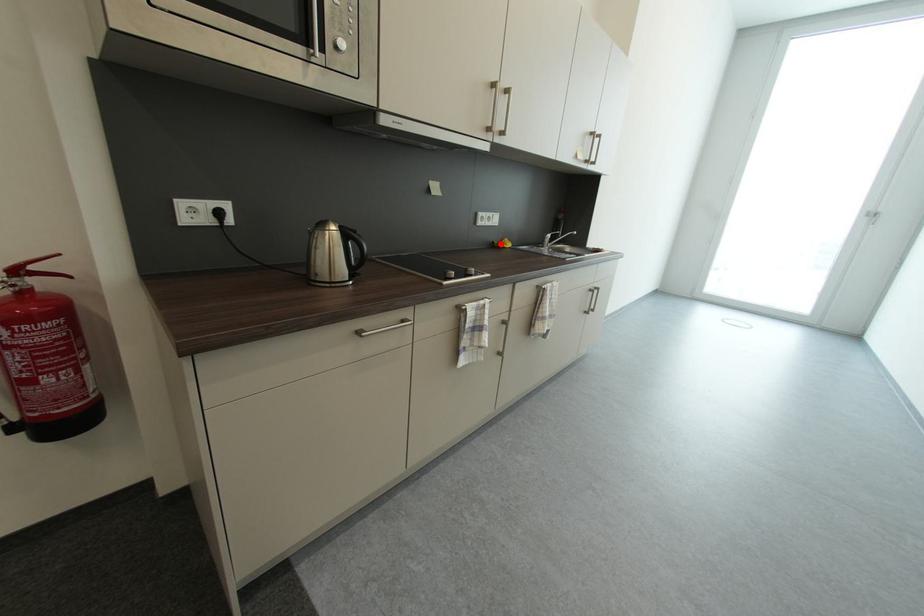
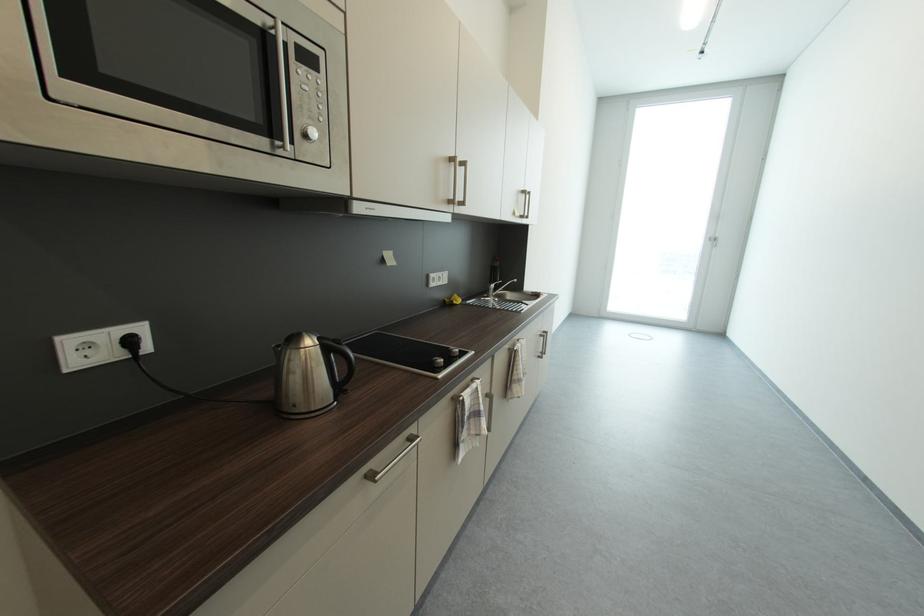
In the second image, find the point that corresponds to the highlighted location in the first image.

(453, 302)